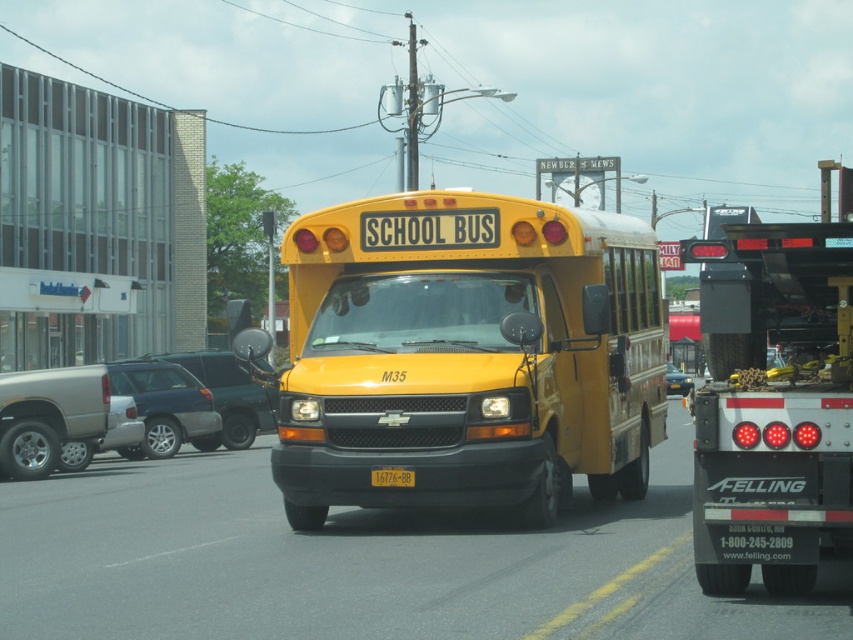
You are a pedestrian standing on the sidewalk and want to cross the street. You see the yellow matte school bus at center and the black rubber tow truck at right. Which vehicle is higher from the ground?

The yellow matte school bus at center is above the black rubber tow truck at right, so the yellow matte school bus at center is higher from the ground.

You are a pedestrian standing at the crosswalk and see a satin black sedan at center and a metallic blue sedan at center. Which car should you wait behind while crossing the street?

You should wait behind the metallic blue sedan at center because the satin black sedan at center is in front of it, meaning the metallic blue sedan is further back and closer to the crosswalk.

You are a delivery driver who needs to park your truck between the two points marked as point [561,416] and point [753,273]. Which point should you park closer to ensure you are positioned behind the school bus?

You should park closer to point [753,273] because point [561,416] is behind point [753,273], meaning that positioning near the latter keeps you in front of the school bus.